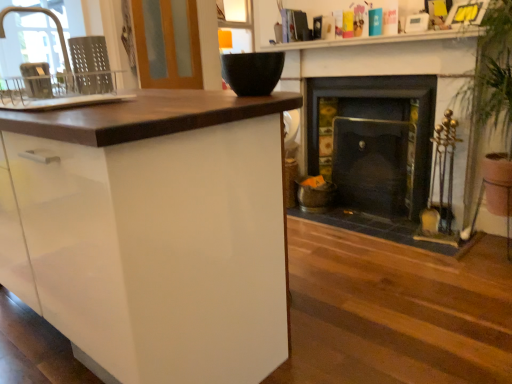
Question: Considering the positions of metallic gray dish rack at left, the second appliance positioned from the right, and black matte bowl at upper center, the first appliance in the right-to-left sequence, in the image, is metallic gray dish rack at left, the second appliance positioned from the right, taller or shorter than black matte bowl at upper center, the first appliance in the right-to-left sequence,?

Choices:
 (A) short
 (B) tall

Answer: (A)

Question: Does point (30, 62) appear closer or farther from the camera than point (246, 67)?

Choices:
 (A) farther
 (B) closer

Answer: (A)

Question: Which of these objects is positioned closest to the wooden screen door at upper left?

Choices:
 (A) matte black bowl at upper center
 (B) black matte bowl at upper center, the first appliance in the right-to-left sequence
 (C) matte silver faucet at left
 (D) metallic gray dish rack at left, the 1th appliance from the left
 (E) white glossy sink at left

Answer: (C)

Question: Considering the real-world distances, which object is farthest from the matte black bowl at upper center?

Choices:
 (A) matte silver faucet at left
 (B) white glossy cabinet at left
 (C) metallic gray dish rack at left, the 1th appliance from the left
 (D) black matte bowl at upper center, which is the 2th appliance from left to right
 (E) wooden screen door at upper left

Answer: (A)